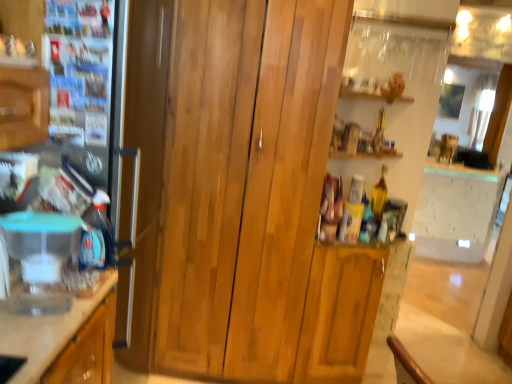
Where is `free space behind transparent plastic container at left`? The width and height of the screenshot is (512, 384). free space behind transparent plastic container at left is located at coordinates (81, 288).